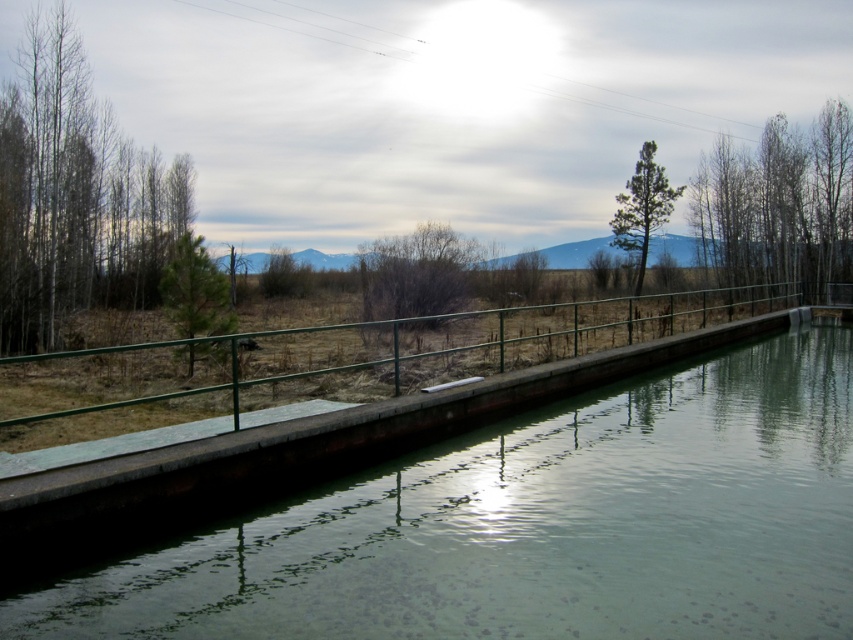
Question: Can you confirm if green concrete river at center is thinner than green metal rail at center?

Choices:
 (A) yes
 (B) no

Answer: (A)

Question: Considering the relative positions of green concrete river at center and green metal rail at center in the image provided, where is green concrete river at center located with respect to green metal rail at center?

Choices:
 (A) above
 (B) below

Answer: (B)

Question: Among these points, which one is farthest from the camera?

Choices:
 (A) (287, 369)
 (B) (699, 476)

Answer: (A)

Question: Does green concrete river at center have a lesser width compared to green metal rail at center?

Choices:
 (A) no
 (B) yes

Answer: (B)